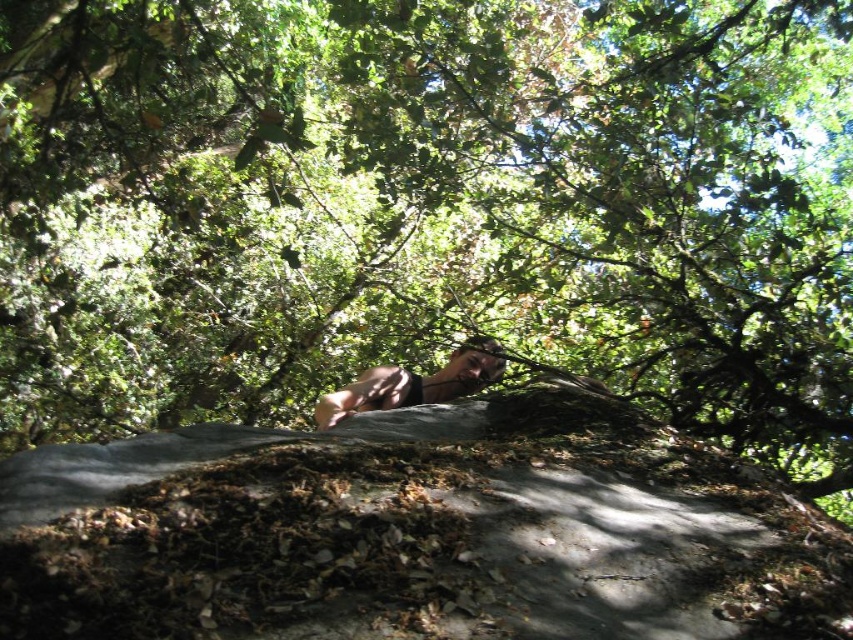
You are a hiker who has just found a gray rough boulder at center and a brown leather belt at center in the forest. Which object is positioned to the right when facing the scene?

The gray rough boulder at center is to the right of the brown leather belt at center, so the gray rough boulder at center is positioned to the right when facing the scene.

You are a hiker who wants to place your brown leather belt at center on the gray rough boulder at center. Based on the scene, will the belt be visible from above the boulder?

The gray rough boulder at center is in front of the brown leather belt at center, so the belt will be hidden behind the boulder and not visible from above.

You are a hiker trying to navigate through the forest. You need to step onto the gray rough boulder at center to cross a small stream. Based on the coordinates provided in the description, can you determine if the boulder is positioned in the middle of the stream or closer to the bank?

The gray rough boulder at center is located at coordinates point (x=416, y=532), which indicates it is positioned closer to the bank rather than the middle of the stream. Therefore, stepping onto it would place you near the edge of the stream rather than the center.